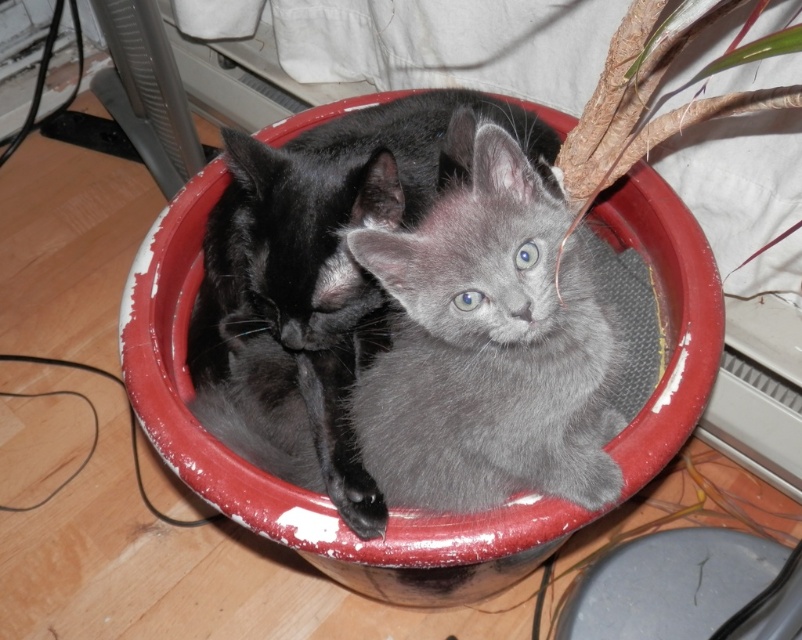
Question: Can you confirm if gray fluffy cat at center is positioned below fibrous brown plant at upper right?

Choices:
 (A) no
 (B) yes

Answer: (B)

Question: Among these points, which one is farthest from the camera?

Choices:
 (A) (778, 548)
 (B) (570, 317)

Answer: (A)

Question: Is gray fluffy cat at center closer to the viewer compared to fibrous brown plant at upper right?

Choices:
 (A) yes
 (B) no

Answer: (B)

Question: Does smooth plastic lid at lower right appear under fibrous brown plant at upper right?

Choices:
 (A) yes
 (B) no

Answer: (A)

Question: Estimate the real-world distances between objects in this image. Which object is farther from the smooth plastic lid at lower right?

Choices:
 (A) fibrous brown plant at upper right
 (B) soft gray kitten at center
 (C) gray fluffy cat at center

Answer: (B)

Question: Considering the real-world distances, which object is closest to the gray fluffy cat at center?

Choices:
 (A) soft gray kitten at center
 (B) smooth plastic lid at lower right
 (C) fibrous brown plant at upper right

Answer: (A)